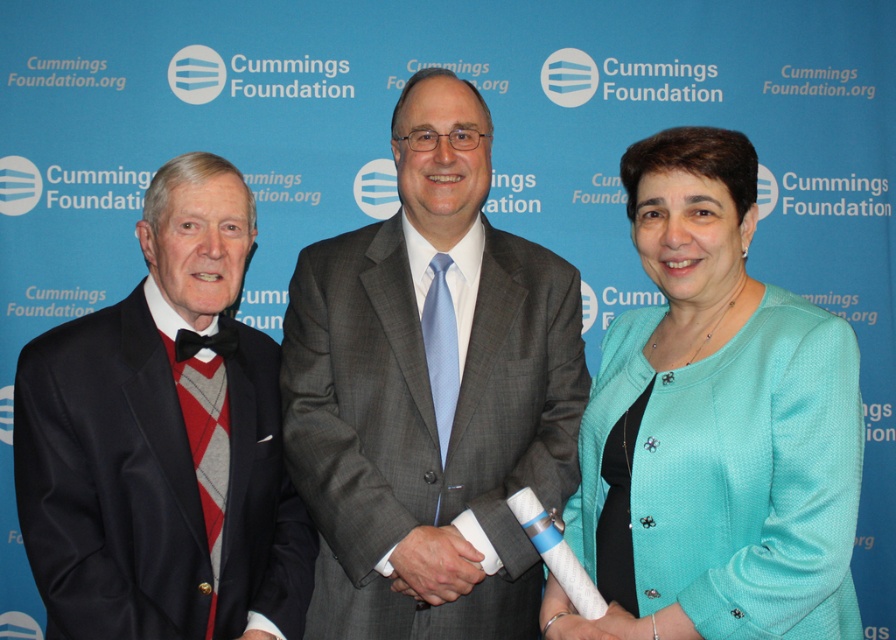
You are organizing a charity event and need to determine seating arrangements based on the size of the suits worn by the attendees. Given the image provided, which attendee wearing either the gray textured suit at center or the black satin suit at left requires a larger seat?

The gray textured suit at center requires a larger seat since it has a larger size compared to the black satin suit at left.

You are a photographer who needs to adjust the lighting to ensure both the gray textured suit at center and the teal fabric jacket at center are evenly lit. Given their current distance apart, is the 18.67 inches gap sufficient for proper lighting adjustment?

The gray textured suit at center and teal fabric jacket at center are 18.67 inches apart from each other. This distance may be sufficient for proper lighting adjustment as professional lighting setups can typically handle such spacing to ensure even illumination.